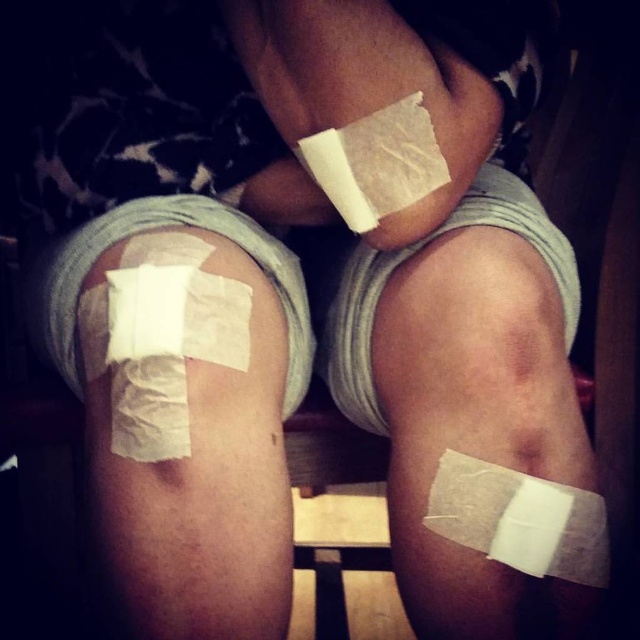
You are a nurse assessing a patient with two bandages on their knees. The bandages are labeled as the white matte bandage at upper center and the white matte bandage at lower right. Which bandage is wider?

The white matte bandage at upper center is wider than the white matte bandage at lower right according to the description.

From the picture: You are a nurse assessing a patient with two bandaged knees. The bandages are labeled as the white matte bandage at upper center and the white matte bandage at lower right. Which bandage is taller?

The white matte bandage at upper center is much taller than the white matte bandage at lower right.